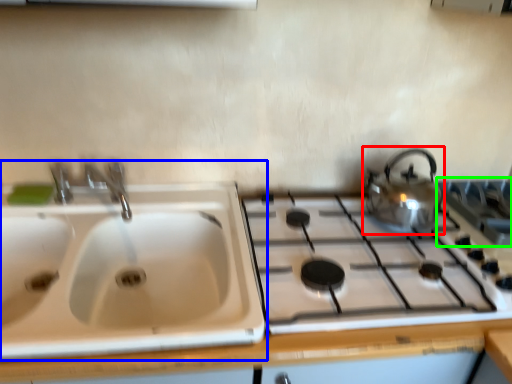
Question: Which object is positioned closest to kettle (highlighted by a red box)? Select from sink (highlighted by a blue box) and gas stove (highlighted by a green box).

Choices:
 (A) sink
 (B) gas stove

Answer: (B)